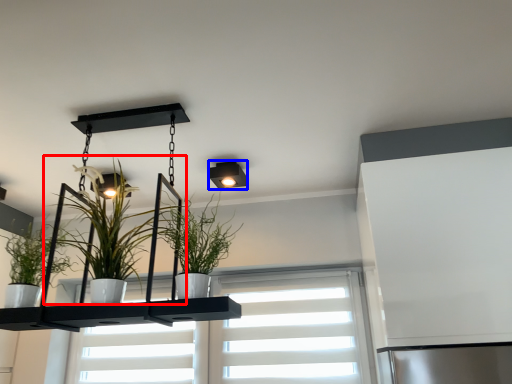
Question: Which point is closer to the camera, houseplant (highlighted by a red box) or light fixture (highlighted by a blue box)?

Choices:
 (A) houseplant
 (B) light fixture

Answer: (A)